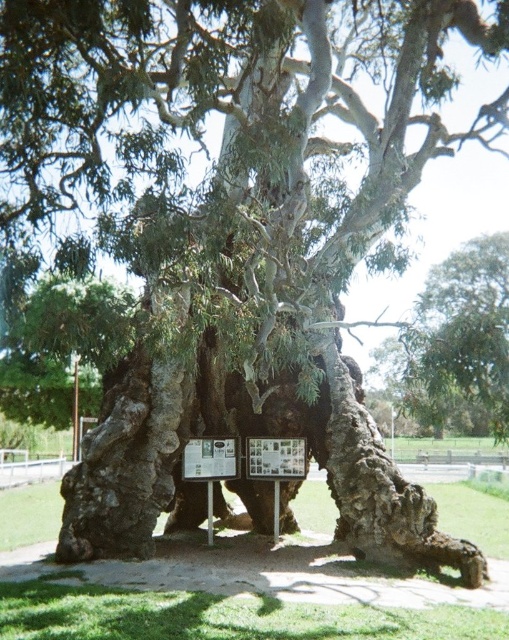
Who is lower down, wooden signboard at center or metallic plaque at center?

Positioned lower is wooden signboard at center.

Image resolution: width=509 pixels, height=640 pixels. Describe the element at coordinates (274, 458) in the screenshot. I see `wooden signboard at center` at that location.

The image size is (509, 640). What do you see at coordinates (274, 458) in the screenshot?
I see `wooden signboard at center` at bounding box center [274, 458].

The width and height of the screenshot is (509, 640). In order to click on wooden signboard at center in this screenshot , I will do `click(274, 458)`.